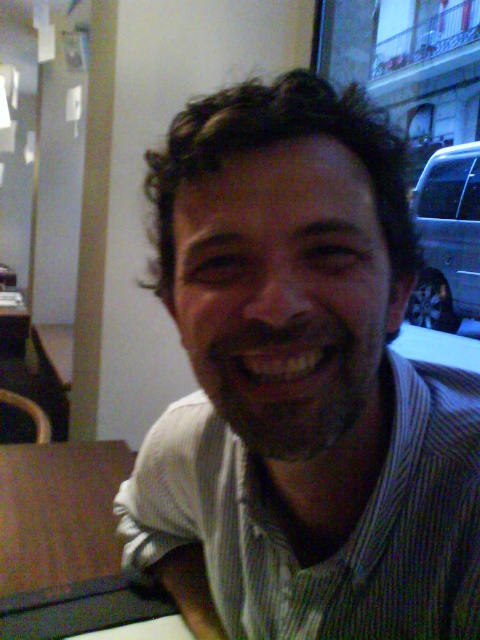
You are trying to decide whether to place a rectangular object that is 2 meters wide on the brown wood table at left. Based on the scene description, can the green striped shirt at center help determine if the table is wide enough?

The green striped shirt at center is narrower than the brown wood table at left, but since the shirt is not a reference for the table width, it cannot confirm if the table can hold a 2m wide object. Check the table dimensions directly.

You are an artist trying to sketch the scene. The green striped shirt at center is crucial for your composition. Where exactly should you place it on your canvas to match the original image?

The green striped shirt at center should be placed at the 2D coordinates point [300,385] to accurately match its position in the original image.

You are a photographer setting up a shoot in this scene. You need to ensure that the green striped shirt at center and the brown wood table at left are both visible in the frame. Given their sizes, which object should you focus on to ensure both are in the shot without cropping?

The green striped shirt at center is much taller than the brown wood table at left, so focusing on the taller object, the green striped shirt at center, will ensure both are visible in the frame without cropping.